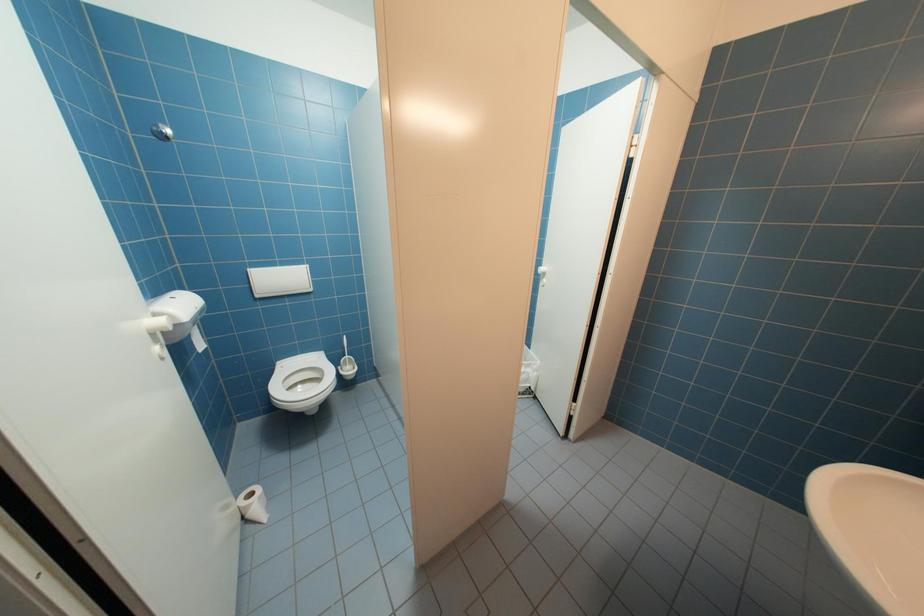
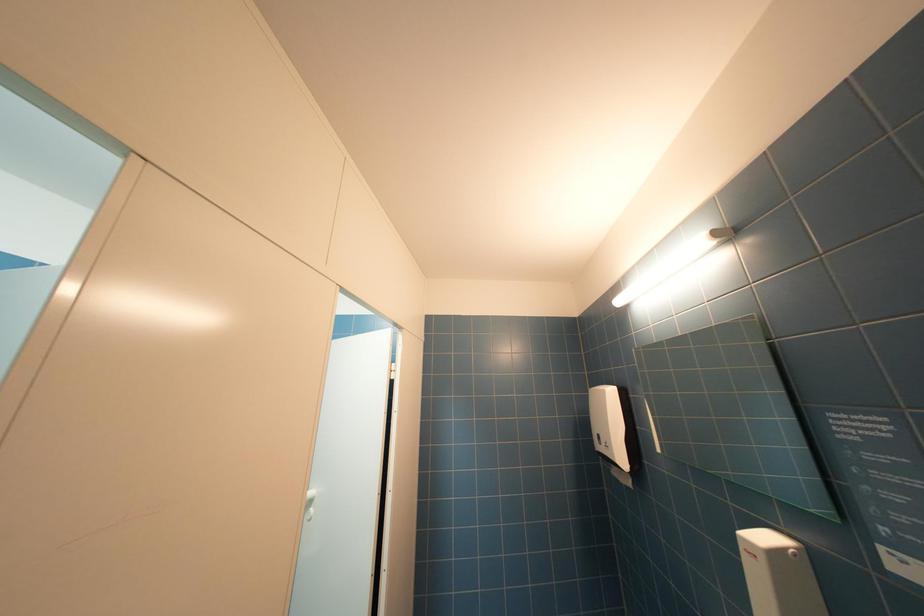
First-person continuous shooting, in which direction is the camera rotating?

The camera's rotation is toward right-up.